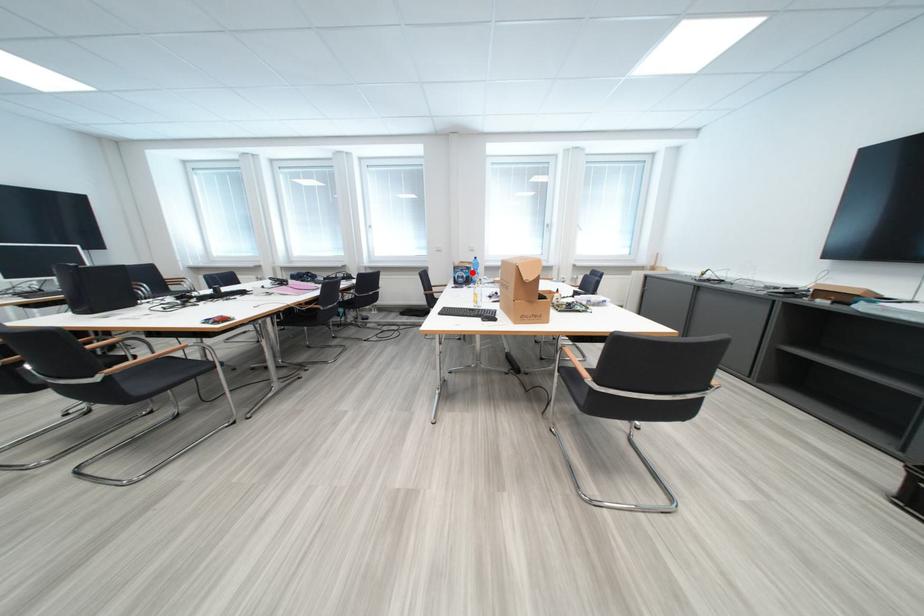
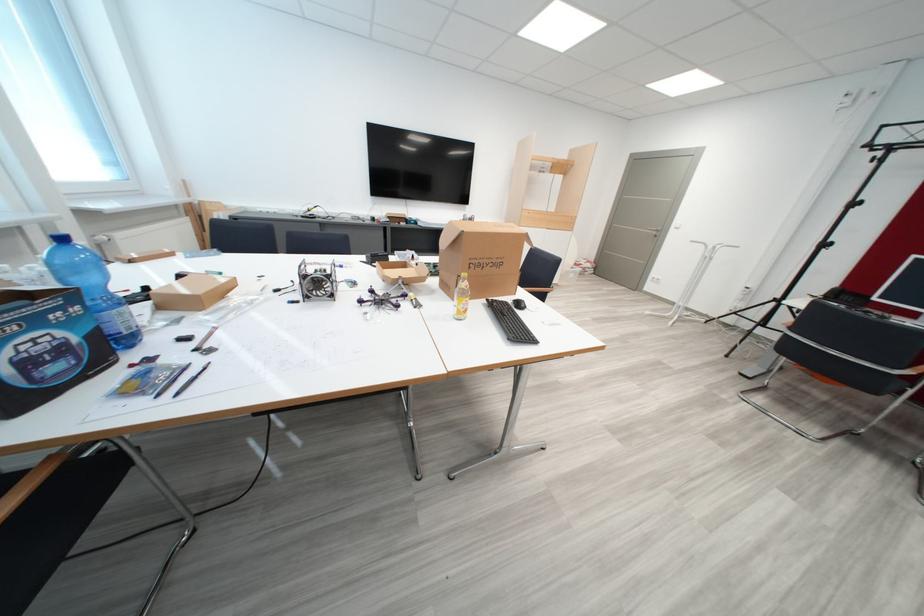
Locate, in the second image, the point that corresponds to the highlighted location in the first image.

(46, 323)